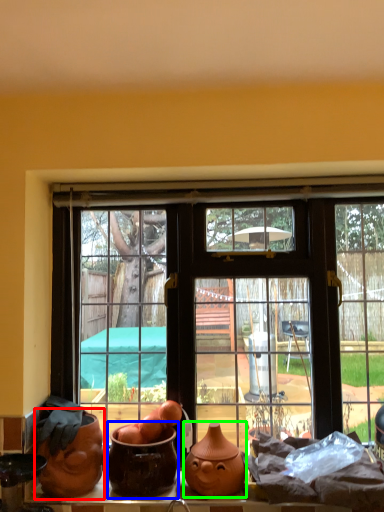
Question: Considering the real-world distances, which object is closest to pottery (highlighted by a red box)? pottery (highlighted by a blue box) or pottery (highlighted by a green box).

Choices:
 (A) pottery
 (B) pottery

Answer: (A)